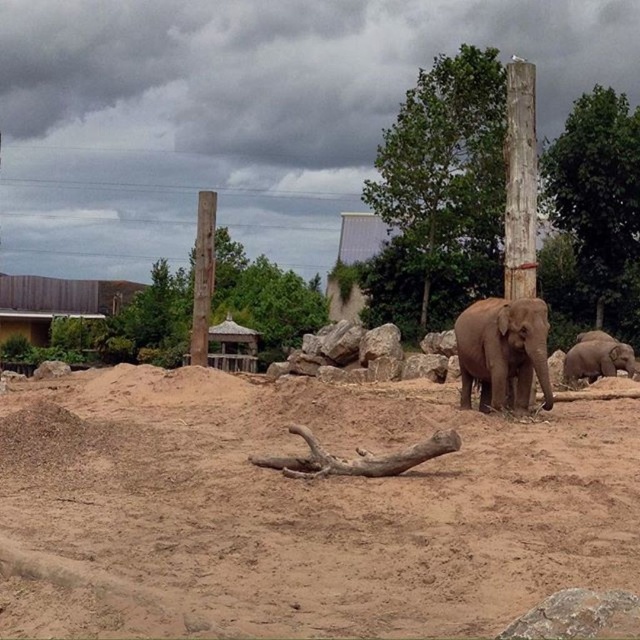
You are standing at the entrance of the zoo enclosure and want to walk towards the point marked as point (515,458). There is another point marked as point (404,209) behind it. Which point will you see first as you walk towards the first point?

You will see point (515,458) first because it is in front of point (404,209).